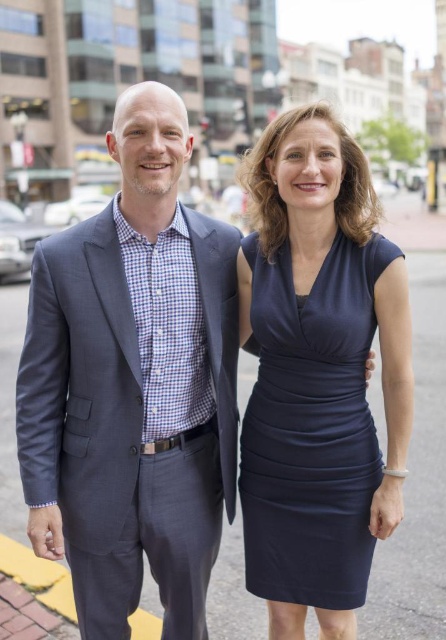
You are a fashion designer observing the scene. You need to place a new accessory on the navy satin dress at center so that it can be seen from above the dark gray asphalt at center. Based on their heights, is this possible?

The navy satin dress at center has a lesser height compared to dark gray asphalt at center. Therefore, placing an accessory on the dress that can be seen from above the asphalt is not possible since the dress is shorter than the asphalt surface.

In the scene shown: You are standing in the city scene shown. You need to reach a specific point located at coordinates point (190, 253). If your maximum comfortable walking distance is 20 meters, can you comfortably walk to this point?

The distance of point (190, 253) from camera is 18.18 meters, so yes, you can comfortably walk to this point as it is within your 20 meters limit.